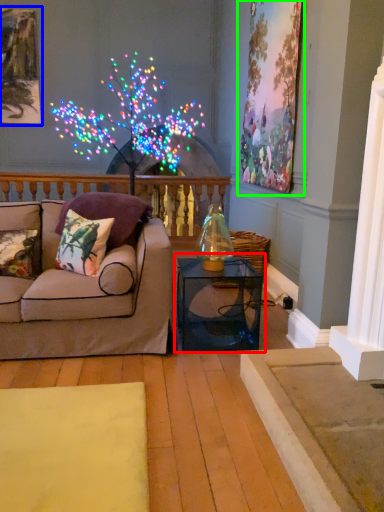
Question: Which object is the closest to the table (highlighted by a red box)? Choose among these: picture frame (highlighted by a blue box) or picture frame (highlighted by a green box).

Choices:
 (A) picture frame
 (B) picture frame

Answer: (B)